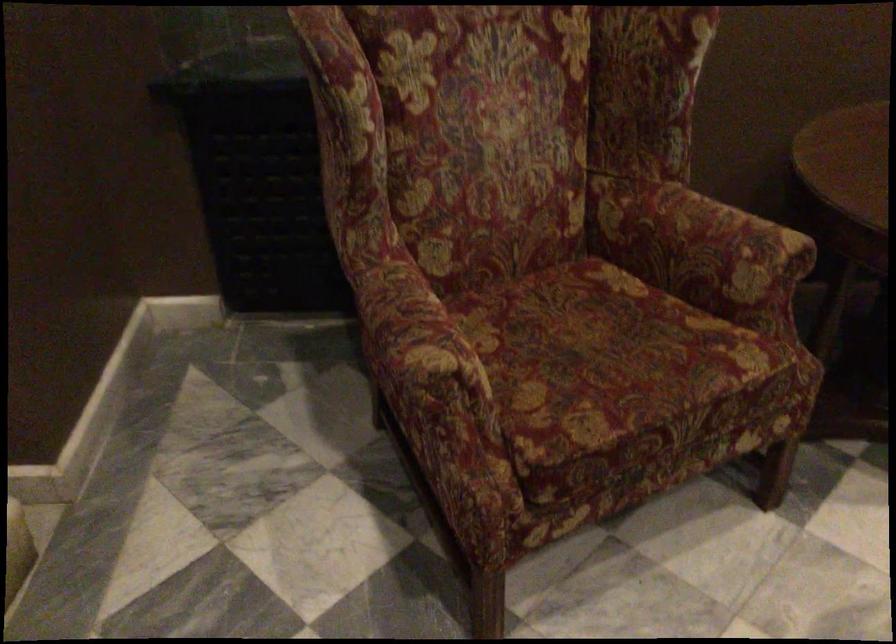
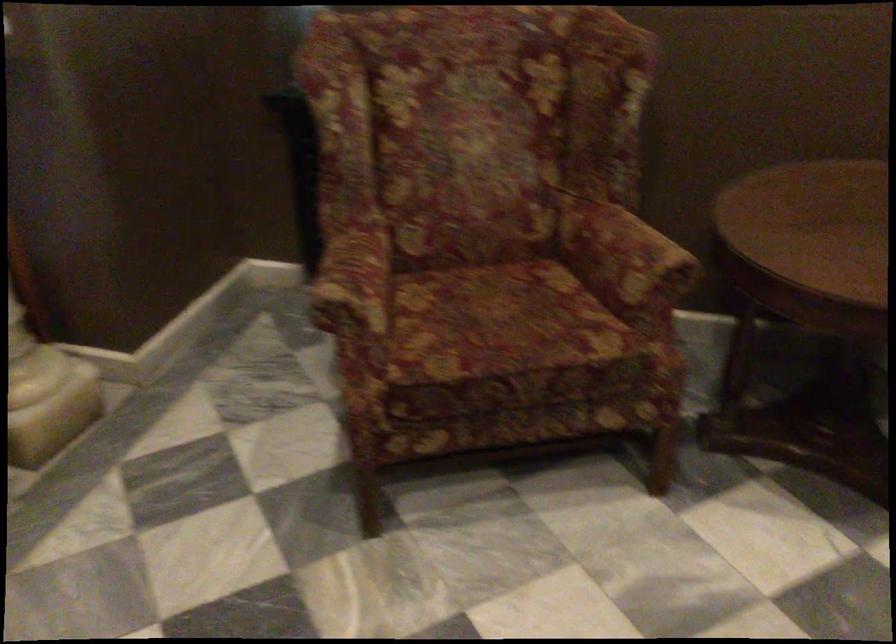
Find the pixel in the second image that matches point (605, 355) in the first image.

(501, 323)